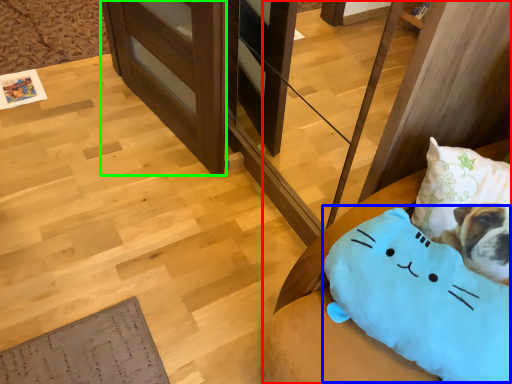
Question: Considering the real-world distances, which object is closest to furniture (highlighted by a red box)? pillow (highlighted by a blue box) or shelf (highlighted by a green box).

Choices:
 (A) pillow
 (B) shelf

Answer: (A)